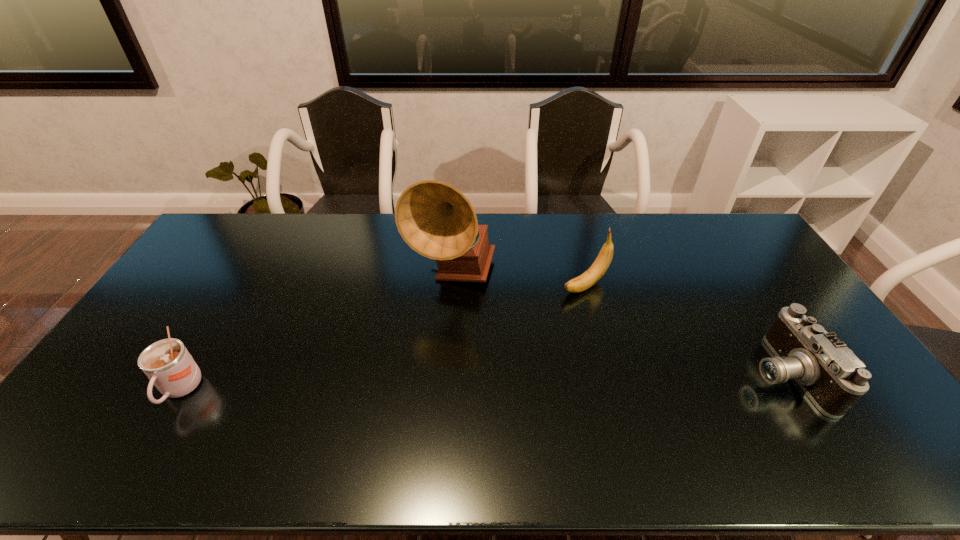
Locate an element on the screen. This screenshot has width=960, height=540. empty location between the phonograph record and the leftmost object is located at coordinates (317, 333).

At what (x,y) coordinates should I click in order to perform the action: click on free space that is in between the third shortest object and the third object from right to left. Please return your answer as a coordinate pair (x, y). This screenshot has width=960, height=540. Looking at the image, I should click on (518, 280).

The height and width of the screenshot is (540, 960). I want to click on blank region between the rightmost object and the second tallest object, so click(x=684, y=329).

Locate an element on the screen. Image resolution: width=960 pixels, height=540 pixels. vacant space that's between the rightmost object and the phonograph record is located at coordinates (618, 324).

This screenshot has width=960, height=540. Identify the location of free space between the camera and the second object from left to right. (618, 324).

You are a GUI agent. You are given a task and a screenshot of the screen. Output one action in this format:
    pyautogui.click(x=<x>, y=<y>)
    Task: Click on the object that ranks as the third closest to the camera
    This screenshot has width=960, height=540.
    Given the screenshot: What is the action you would take?
    pyautogui.click(x=167, y=363)

Where is `the third closest object relative to the rightmost object`? This screenshot has height=540, width=960. the third closest object relative to the rightmost object is located at coordinates (167, 363).